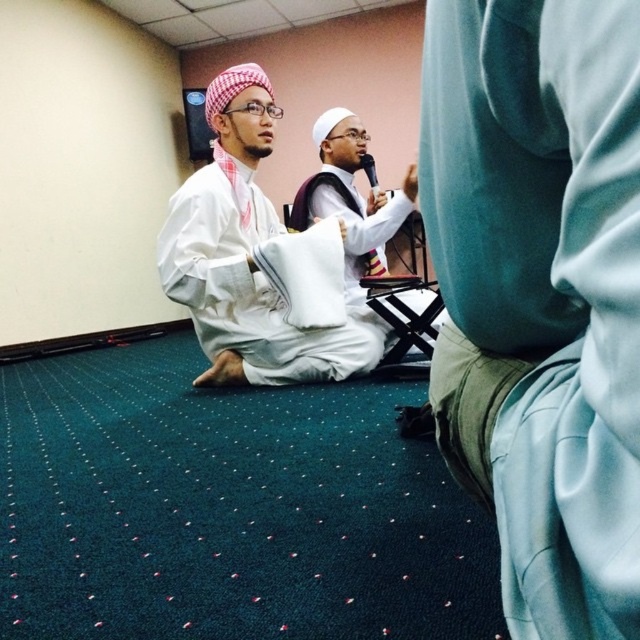
Question: Which of the following is the farthest from the observer?

Choices:
 (A) white matte shirt at center
 (B) white cotton robe at center
 (C) light blue fabric at center

Answer: (A)

Question: Which is farther from the white matte shirt at center?

Choices:
 (A) white cotton robe at center
 (B) light blue fabric at center

Answer: (B)

Question: Which of the following is the closest to the observer?

Choices:
 (A) light blue fabric at center
 (B) white matte shirt at center

Answer: (A)

Question: Can you confirm if white cotton robe at center is thinner than white matte shirt at center?

Choices:
 (A) yes
 (B) no

Answer: (B)

Question: Is light blue fabric at center further to the viewer compared to white matte shirt at center?

Choices:
 (A) no
 (B) yes

Answer: (A)

Question: Is light blue fabric at center positioned before white matte shirt at center?

Choices:
 (A) yes
 (B) no

Answer: (A)